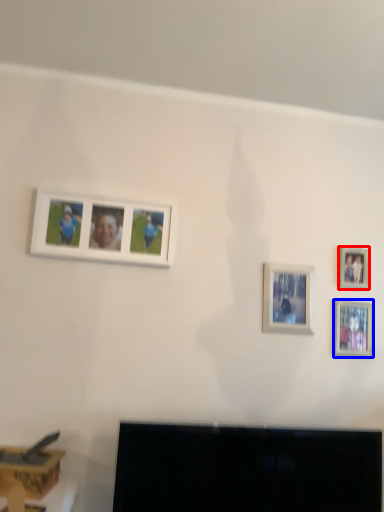
Question: Among these objects, which one is nearest to the camera, picture frame (highlighted by a red box) or picture frame (highlighted by a blue box)?

Choices:
 (A) picture frame
 (B) picture frame

Answer: (B)